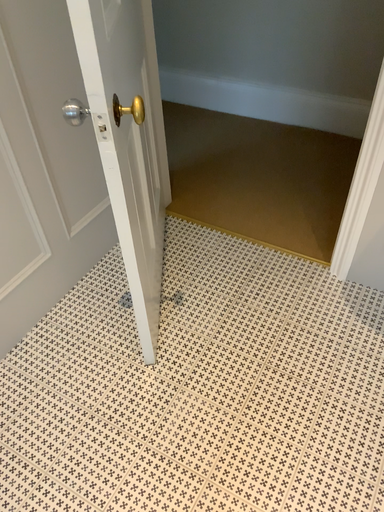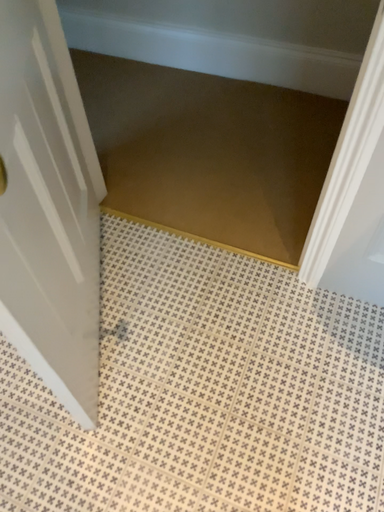
Question: Which way did the camera rotate in the video?

Choices:
 (A) rotated upward
 (B) rotated downward

Answer: (B)